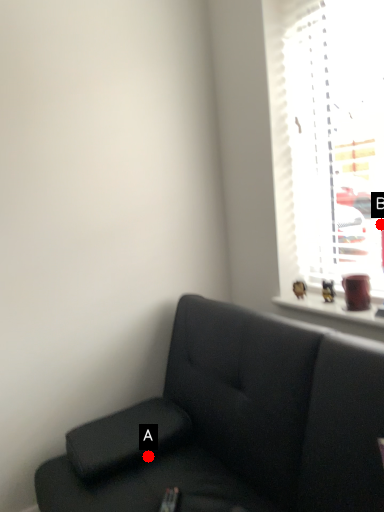
Question: Two points are circled on the image, labeled by A and B beside each circle. Among these points, which one is farthest from the camera?

Choices:
 (A) A is further
 (B) B is further

Answer: (B)